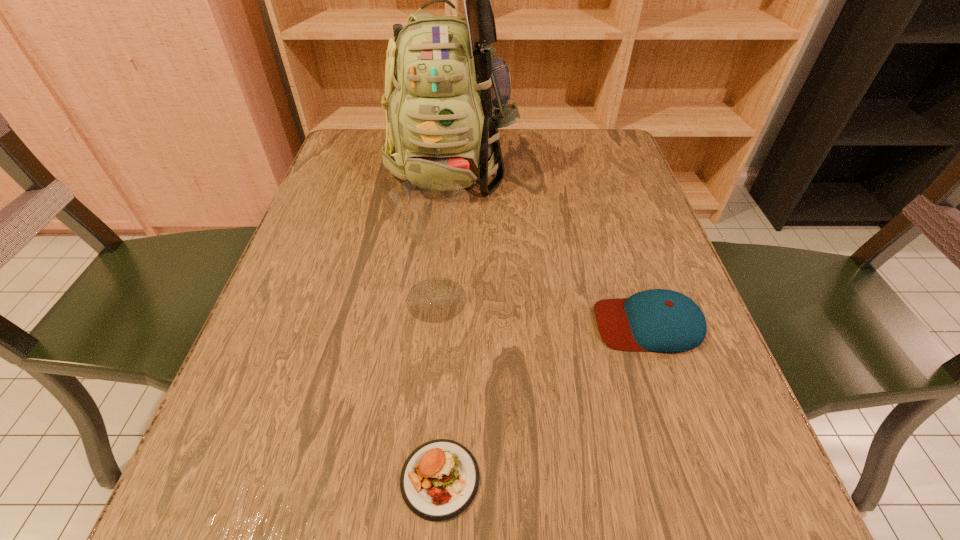
Where is `free space located with the bill of the rightmost object facing forward`? The height and width of the screenshot is (540, 960). free space located with the bill of the rightmost object facing forward is located at coordinates pos(472,324).

Identify the location of vacant space located 0.380m with the bill of the rightmost object facing forward. Image resolution: width=960 pixels, height=540 pixels. (372, 324).

Image resolution: width=960 pixels, height=540 pixels. I want to click on free space located on the left of the nearest object, so click(x=263, y=478).

Where is `object located in the far edge section of the desktop`? object located in the far edge section of the desktop is located at coordinates (446, 95).

Where is `object located at the near edge`? The width and height of the screenshot is (960, 540). object located at the near edge is located at coordinates (439, 480).

Where is `object at the left edge`? Image resolution: width=960 pixels, height=540 pixels. object at the left edge is located at coordinates (446, 95).

Locate an element on the screen. The image size is (960, 540). object present at the right edge is located at coordinates (658, 320).

Identify the location of object that is at the far left corner. (446, 95).

Image resolution: width=960 pixels, height=540 pixels. I want to click on vacant area at the far edge, so coord(513,155).

This screenshot has height=540, width=960. In the image, there is a desktop. In order to click on free space at the near edge in this screenshot , I will do `click(371, 478)`.